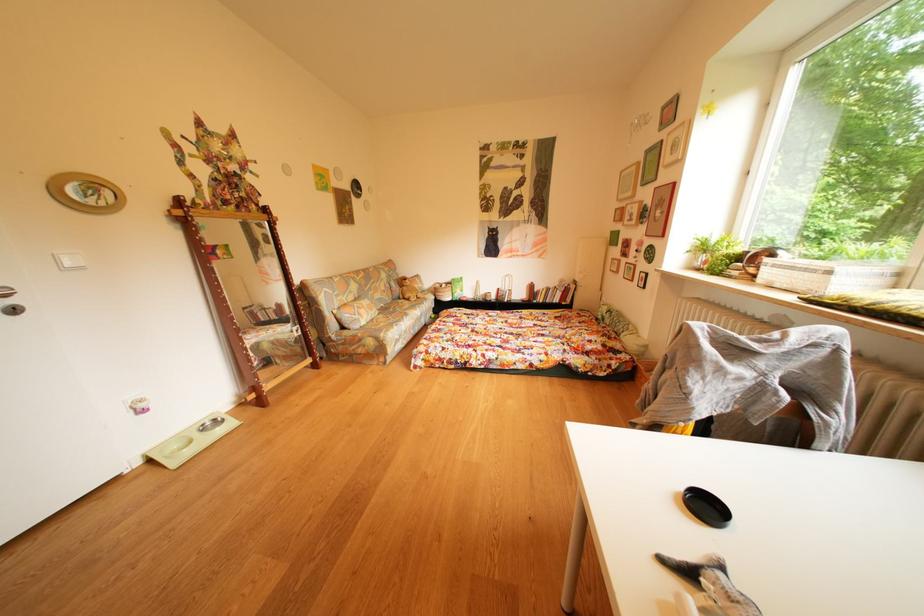
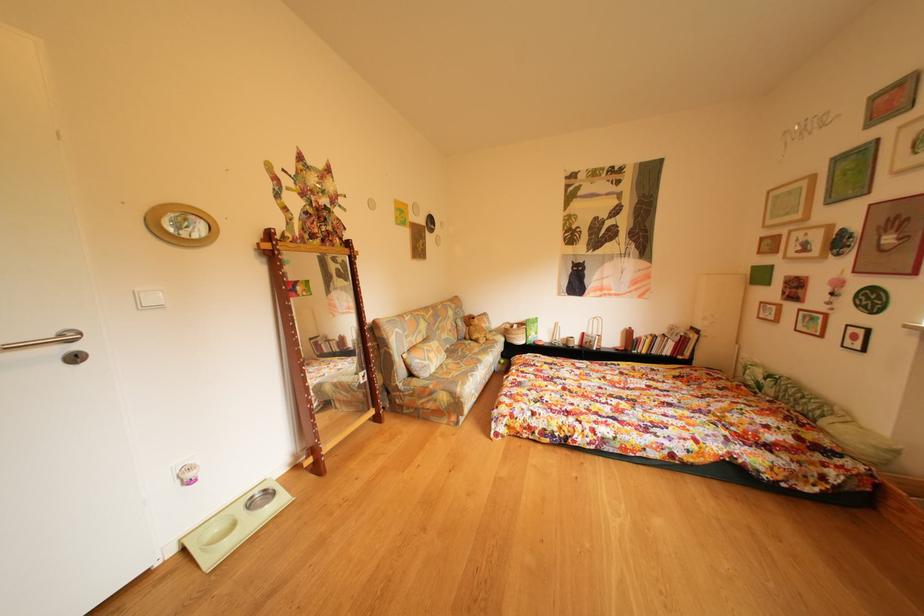
The images are taken continuously from a first-person perspective. In which direction are you moving?

The movement direction of the cameraman is left, forward.